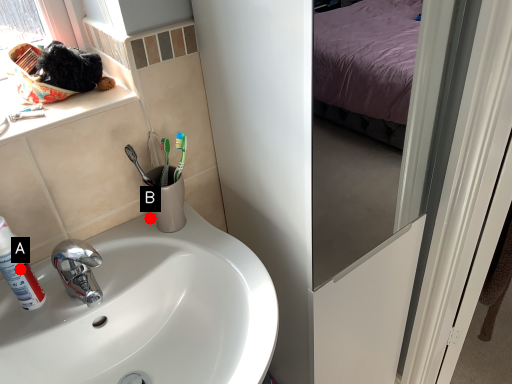
Question: Two points are circled on the image, labeled by A and B beside each circle. Which point is closer to the camera?

Choices:
 (A) A is closer
 (B) B is closer

Answer: (A)